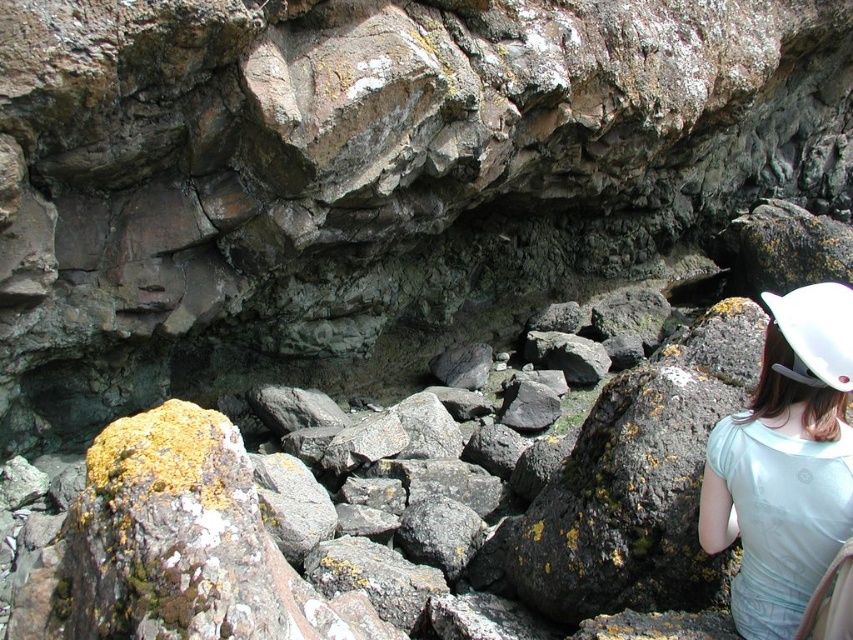
Question: From the image, what is the correct spatial relationship of white hard hat at center right in relation to white matte hard hat at right?

Choices:
 (A) right
 (B) left

Answer: (B)

Question: Which point is farther from the camera taking this photo?

Choices:
 (A) (747, 522)
 (B) (799, 349)

Answer: (A)

Question: Is white hard hat at center right smaller than white matte hard hat at right?

Choices:
 (A) yes
 (B) no

Answer: (B)

Question: Which of the following is the closest to the observer?

Choices:
 (A) (756, 538)
 (B) (817, 328)

Answer: (B)

Question: Can you confirm if white hard hat at center right is positioned to the right of white matte hard hat at right?

Choices:
 (A) yes
 (B) no

Answer: (B)